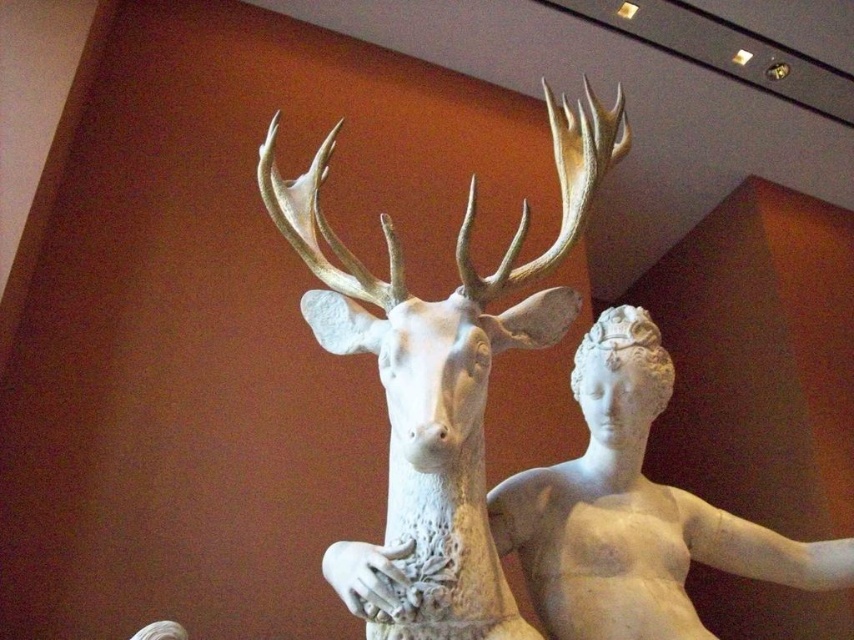
You are standing in front of a classical sculpture that has two figures. The deer is at the center and the human female is to its right. There is a specific point at coordinates [442,378]. Which figure does this point belong to?

The point at coordinates [442,378] belongs to the white marble deer at center as stated in the Objects Description.

You are an art conservator who needs to clean the white marble deer at center. Your cleaning tool has a maximum reach of 1 meter. Based on the image, can you safely clean the deer without moving the tool closer than 1 meter?

The distance between the white marble deer at center and the camera is 1.14 meters, which is greater than the tool reach of 1 meter. Therefore, you can safely clean the deer without moving the tool closer than 1 meter.

You are an art curator planning to display the white marble deer at center and the white marble statue at center in a gallery. Given their sizes, which one would require a larger base to support its weight?

The white marble deer at center requires a larger base because it has a larger size compared to the white marble statue at center, necessitating a more substantial support structure.